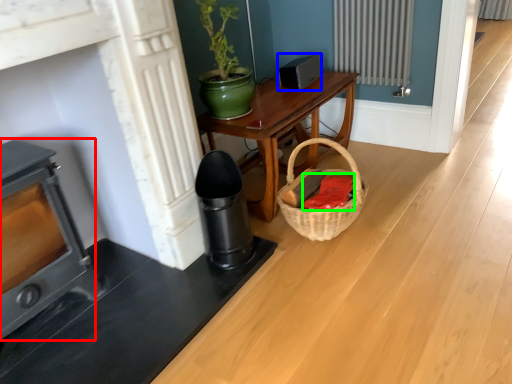
Question: Which object is positioned farthest from heater (highlighted by a red box)? Select from appliance (highlighted by a blue box) and material (highlighted by a green box).

Choices:
 (A) appliance
 (B) material

Answer: (A)